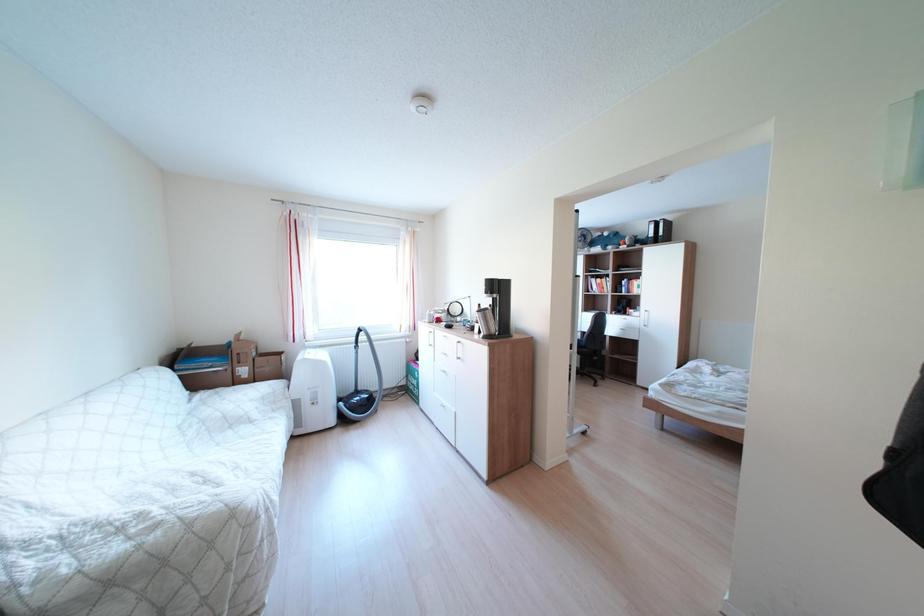
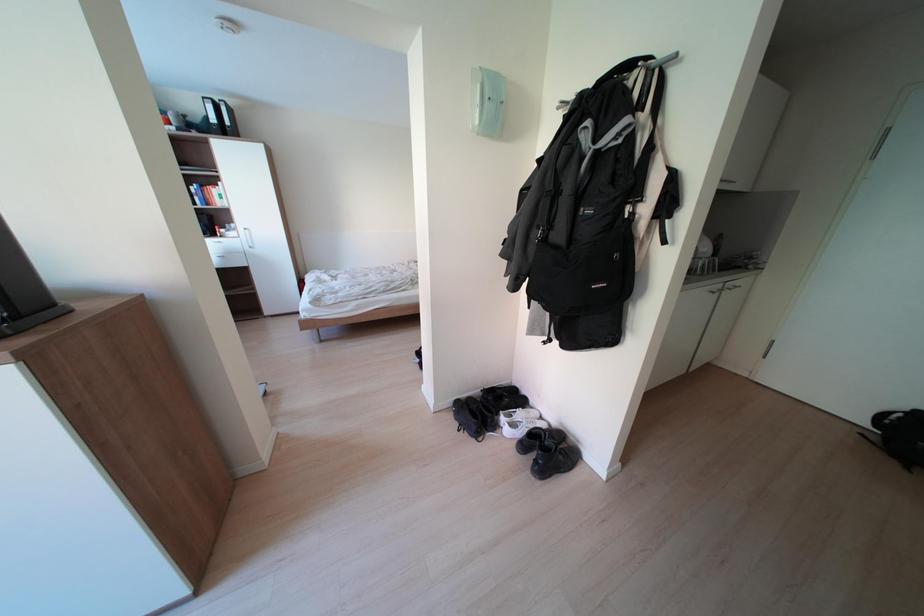
The images are taken continuously from a first-person perspective. In which direction is your viewpoint rotating?

The rotation direction of the camera is right-down.